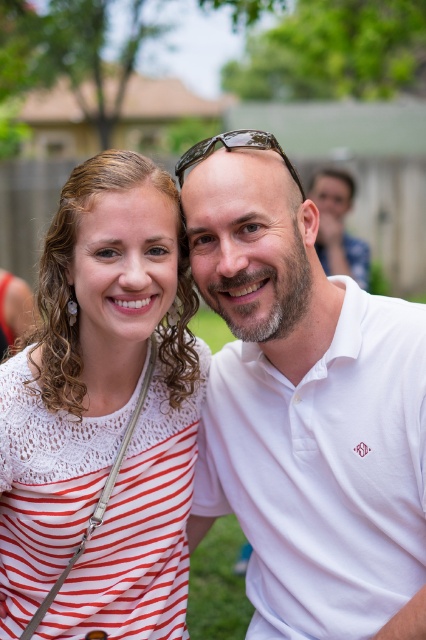
Question: Which point is farther from the camera taking this photo?

Choices:
 (A) (215, 140)
 (B) (270, 305)
 (C) (146, 632)

Answer: (C)

Question: Considering the relative positions of white cotton polo shirt at center and clear plastic sunglasses at center in the image provided, where is white cotton polo shirt at center located with respect to clear plastic sunglasses at center?

Choices:
 (A) below
 (B) above

Answer: (A)

Question: Is white cotton polo shirt at center further to the viewer compared to clear plastic sunglasses at center?

Choices:
 (A) yes
 (B) no

Answer: (B)

Question: Which object is closer to the camera taking this photo?

Choices:
 (A) white cotton polo shirt at center
 (B) clear plastic sunglasses at center

Answer: (A)

Question: Is white cotton polo shirt at center positioned in front of clear plastic sunglasses at center?

Choices:
 (A) yes
 (B) no

Answer: (A)

Question: Which point is farther to the camera?

Choices:
 (A) (258, 138)
 (B) (397, 506)
 (C) (138, 582)

Answer: (C)